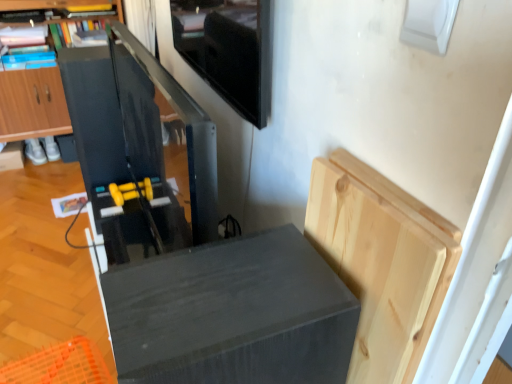
Question: From the image's perspective, is natural wood cutting board at upper right, positioned as the first cabinetry in front-to-back order, located above matte black speaker at lower center?

Choices:
 (A) no
 (B) yes

Answer: (B)

Question: Is natural wood cutting board at upper right, positioned as the first cabinetry in front-to-back order, outside of matte black speaker at lower center?

Choices:
 (A) yes
 (B) no

Answer: (A)

Question: Does natural wood cutting board at upper right, the 2th cabinetry positioned from the top, appear on the left side of matte black speaker at lower center?

Choices:
 (A) no
 (B) yes

Answer: (A)

Question: Is natural wood cutting board at upper right, the 1th cabinetry in the bottom-to-top sequence, placed right next to matte black speaker at lower center?

Choices:
 (A) yes
 (B) no

Answer: (B)

Question: Can you confirm if natural wood cutting board at upper right, the 1th cabinetry in the bottom-to-top sequence, is bigger than matte black speaker at lower center?

Choices:
 (A) yes
 (B) no

Answer: (B)

Question: From the image's perspective, is matte black speaker at lower center located above or below natural wood cutting board at upper right, the first cabinetry from the right?

Choices:
 (A) above
 (B) below

Answer: (B)

Question: In the image, is matte black speaker at lower center on the left side or the right side of natural wood cutting board at upper right, the 2th cabinetry positioned from the top?

Choices:
 (A) left
 (B) right

Answer: (A)

Question: Does point (313, 375) appear closer or farther from the camera than point (367, 294)?

Choices:
 (A) closer
 (B) farther

Answer: (A)

Question: Considering the positions of matte black speaker at lower center and natural wood cutting board at upper right, which is the second cabinetry from left to right, in the image, is matte black speaker at lower center taller or shorter than natural wood cutting board at upper right, which is the second cabinetry from left to right,?

Choices:
 (A) tall
 (B) short

Answer: (A)

Question: From their relative heights in the image, would you say matte black cabinet at left, the 2th cabinetry positioned from the front, is taller or shorter than natural wood cutting board at upper right, positioned as the first cabinetry in front-to-back order?

Choices:
 (A) tall
 (B) short

Answer: (A)

Question: Based on their positions, is matte black cabinet at left, the second cabinetry ordered from the bottom, located to the left or right of natural wood cutting board at upper right, positioned as the second cabinetry in back-to-front order?

Choices:
 (A) left
 (B) right

Answer: (A)

Question: Considering the positions of matte black cabinet at left, the second cabinetry ordered from the bottom, and natural wood cutting board at upper right, positioned as the second cabinetry in back-to-front order, in the image, is matte black cabinet at left, the second cabinetry ordered from the bottom, bigger or smaller than natural wood cutting board at upper right, positioned as the second cabinetry in back-to-front order,?

Choices:
 (A) big
 (B) small

Answer: (A)

Question: From the image's perspective, is matte black cabinet at left, the second cabinetry ordered from the bottom, positioned above or below natural wood cutting board at upper right, positioned as the second cabinetry in back-to-front order?

Choices:
 (A) above
 (B) below

Answer: (A)

Question: From a real-world perspective, is matte black speaker at lower center physically located above or below matte black cabinet at left, arranged as the second cabinetry when viewed from the right?

Choices:
 (A) below
 (B) above

Answer: (B)

Question: Is point (257, 342) closer or farther from the camera than point (17, 79)?

Choices:
 (A) closer
 (B) farther

Answer: (A)